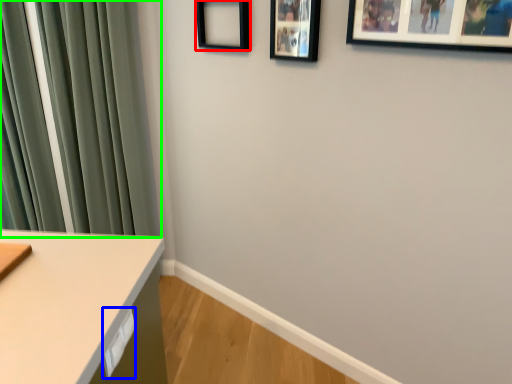
Question: Which object is positioned farthest from picture frame (highlighted by a red box)? Select from drawer (highlighted by a blue box) and curtain (highlighted by a green box).

Choices:
 (A) drawer
 (B) curtain

Answer: (A)